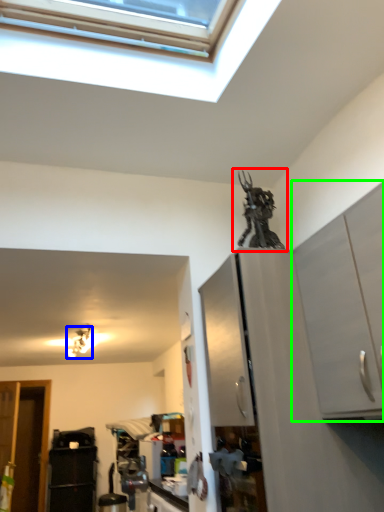
Question: Which object is positioned closest to sculpture (highlighted by a red box)? Select from light fixture (highlighted by a blue box) and cabinetry (highlighted by a green box).

Choices:
 (A) light fixture
 (B) cabinetry

Answer: (B)